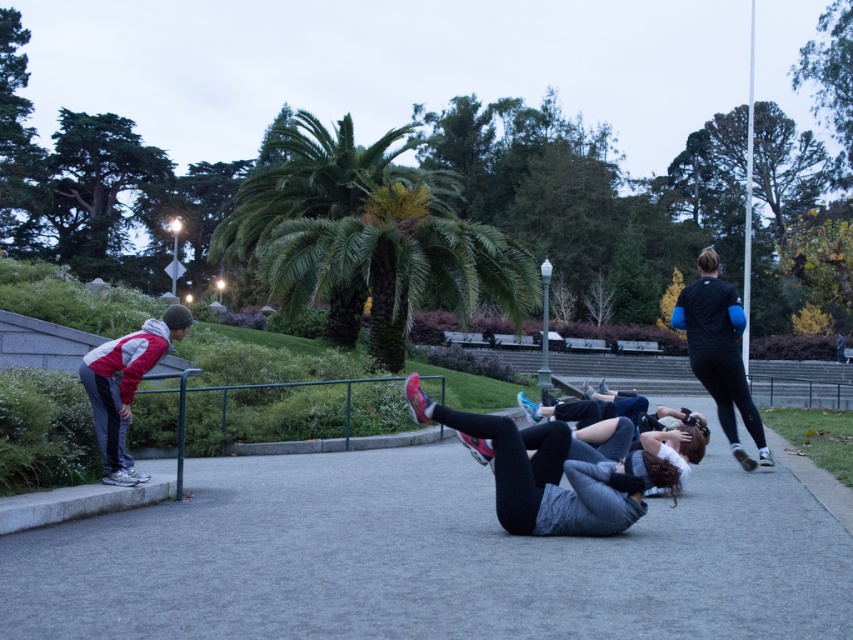
Can you confirm if gray fabric leggings at center is thinner than reddish-gray sneakers at left?

In fact, gray fabric leggings at center might be wider than reddish-gray sneakers at left.

Is gray fabric leggings at center positioned in front of reddish-gray sneakers at left?

Yes.

Is point (529, 508) positioned after point (171, 348)?

No, it is not.

What are the coordinates of `gray fabric leggings at center` in the screenshot? It's located at (550, 474).

Consider the image. Who is more distant from viewer, (837, 600) or (514, 451)?

The point (514, 451) is behind.

Between gray asphalt pavement at center and gray fabric leggings at center, which one has more height?

With more height is gray fabric leggings at center.

Identify the location of gray asphalt pavement at center. The width and height of the screenshot is (853, 640). (428, 557).

The width and height of the screenshot is (853, 640). Find the location of `gray asphalt pavement at center`. gray asphalt pavement at center is located at coordinates tap(428, 557).

Measure the distance between point (604, 532) and camera.

A distance of 6.03 meters exists between point (604, 532) and camera.

Is point (469, 422) less distant than point (689, 362)?

Yes, it is in front of point (689, 362).

Find the location of a particular element. This screenshot has width=853, height=640. gray fabric leggings at center is located at coordinates (550, 474).